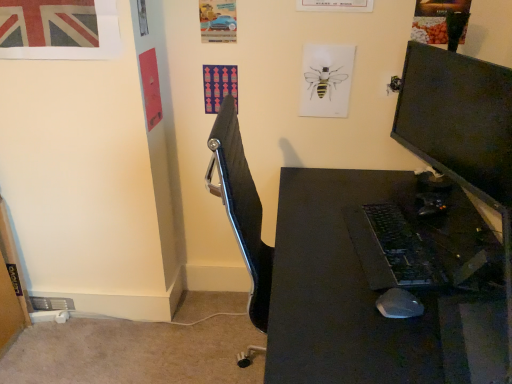
This screenshot has width=512, height=384. In order to click on vacant space behind black plastic keyboard at center-right in this screenshot , I will do `click(367, 191)`.